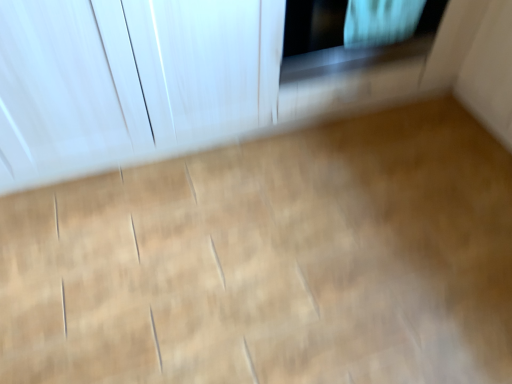
Identify the location of transparent glass window at upper center. (350, 39).

Image resolution: width=512 pixels, height=384 pixels. What do you see at coordinates (350, 39) in the screenshot? I see `transparent glass window at upper center` at bounding box center [350, 39].

Identify the location of transparent glass window at upper center. (350, 39).